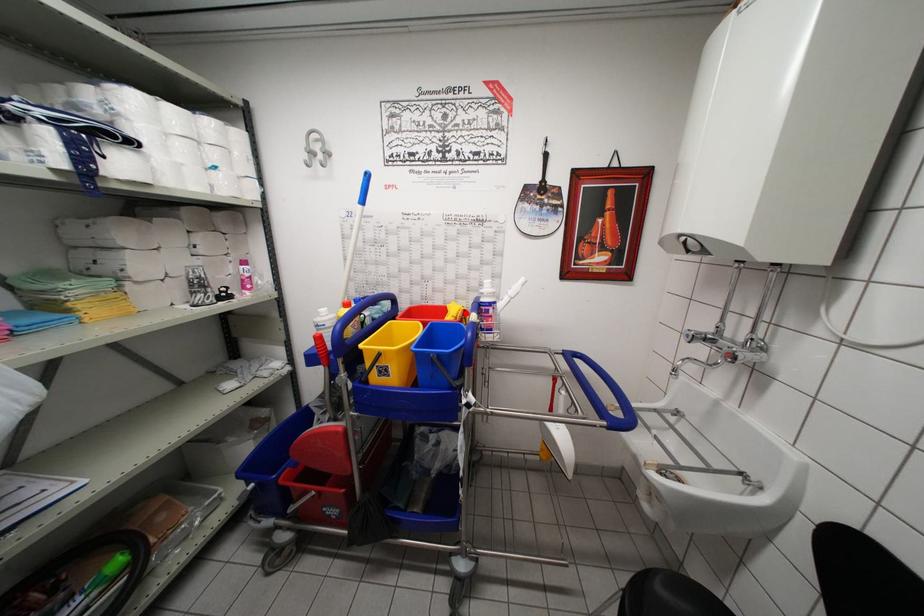
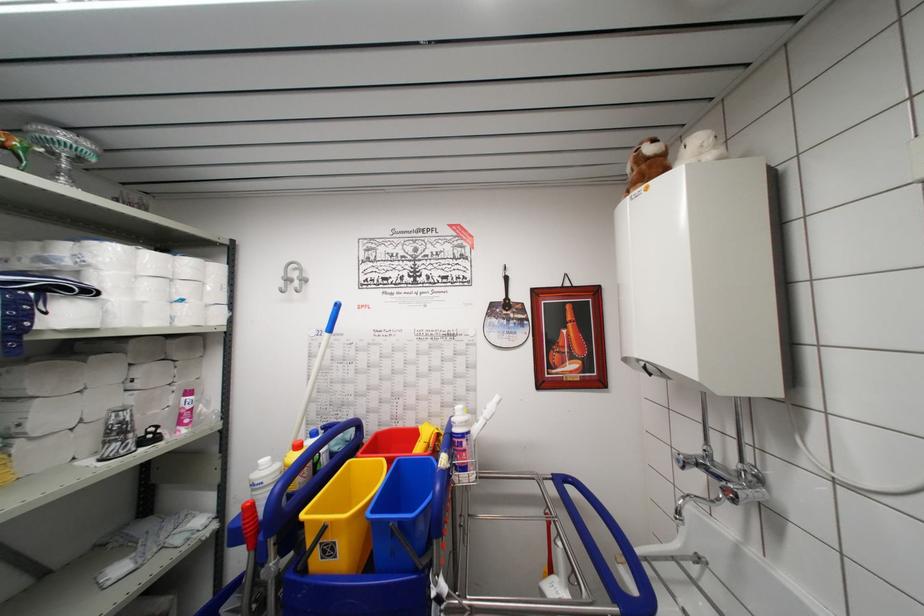
Where in the second image is the point corresponding to the highlighted location from the first image?

(439, 436)